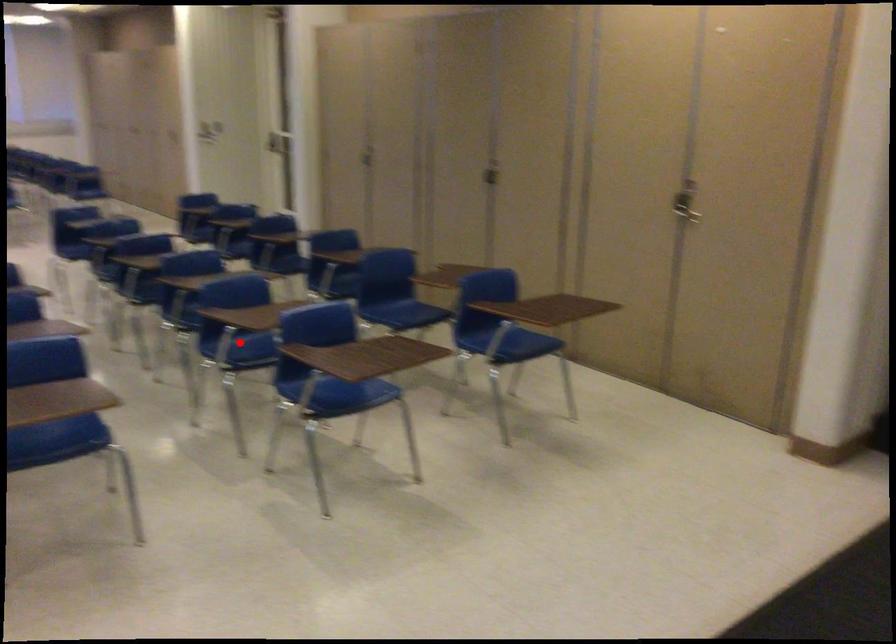
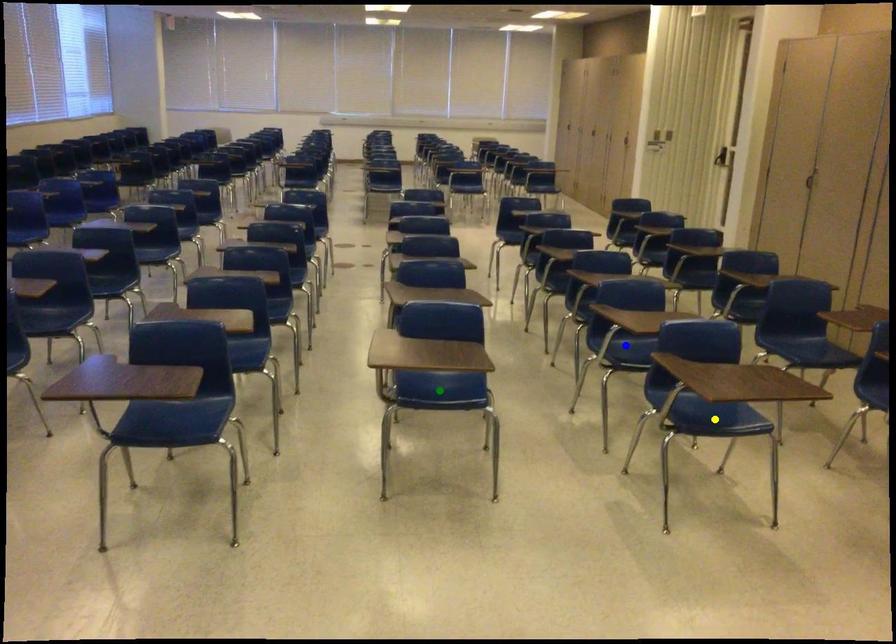
Question: I am providing you with two images of the same scene from different viewpoints. A red point is marked on the first image. You are given multiple points on the second image. Which point in image 2 represents the same 3d spot as the red point in image 1?

Choices:
 (A) yellow point
 (B) green point
 (C) blue point

Answer: (C)